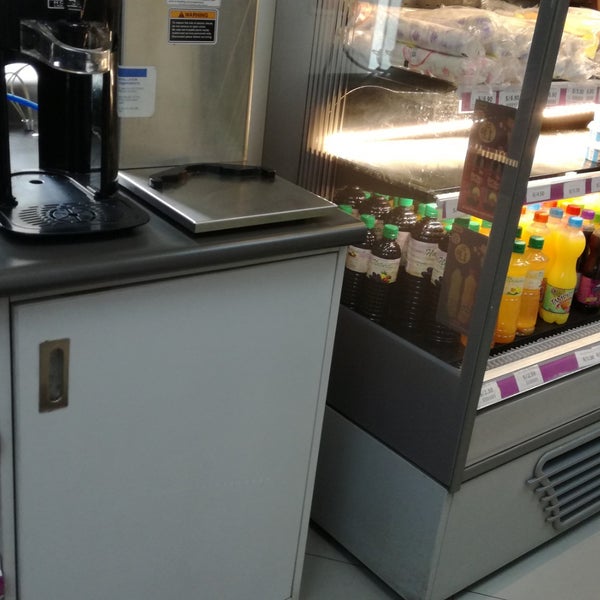
This screenshot has width=600, height=600. What are the coordinates of `stickers on left glass side of refridgerated case` in the screenshot? It's located at (485, 182), (468, 278).